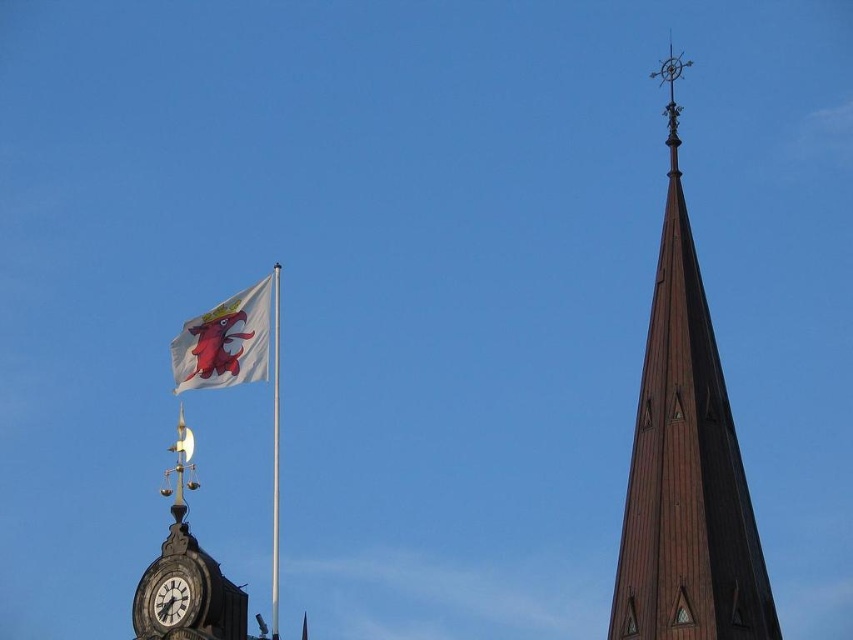
You are an architect designing a new rooftop garden between the brown wooden spire at upper right and the white fabric flag at upper left. Which structure should you place your garden closer to if you want it to be more sheltered from the wind? Please explain your reasoning based on their widths.

The brown wooden spire at upper right might be wider than the white fabric flag at upper left. Since a wider structure can block more wind, placing the garden closer to the brown wooden spire at upper right would provide better shelter from the wind.

You are standing in front of the clock tower and notice two clocks. One is the matte black clock at lower left and the other is the white clock face at lower left. Which clock is positioned to the right of the other?

The matte black clock at lower left is positioned to the right of the white clock face at lower left.

You are an architect assessing the structural integrity of the brown wooden spire at upper right and the matte black clock at lower left. Based on their widths, which structure might require additional support to prevent tilting?

The brown wooden spire at upper right requires additional support because its width surpasses that of the matte black clock at lower left, making it potentially less stable.